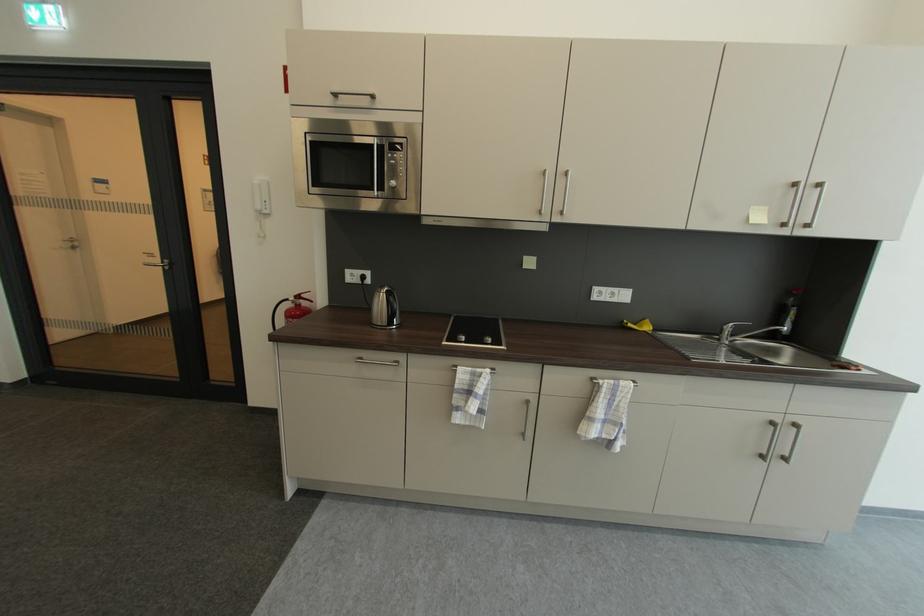
Find where to pull the microwave door handle. Please return your answer as a coordinate pair (x, y).

(378, 167)